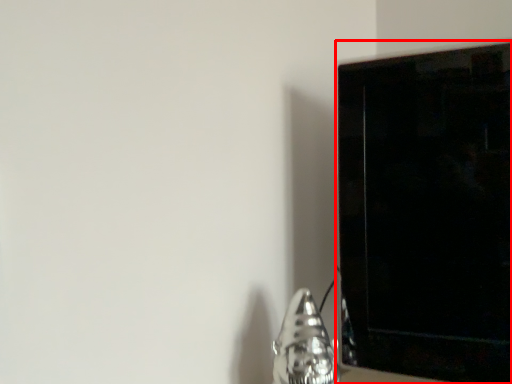
Question: From the image, what is the correct spatial relationship of furniture (annotated by the red box) in relation to silver?

Choices:
 (A) left
 (B) right

Answer: (B)